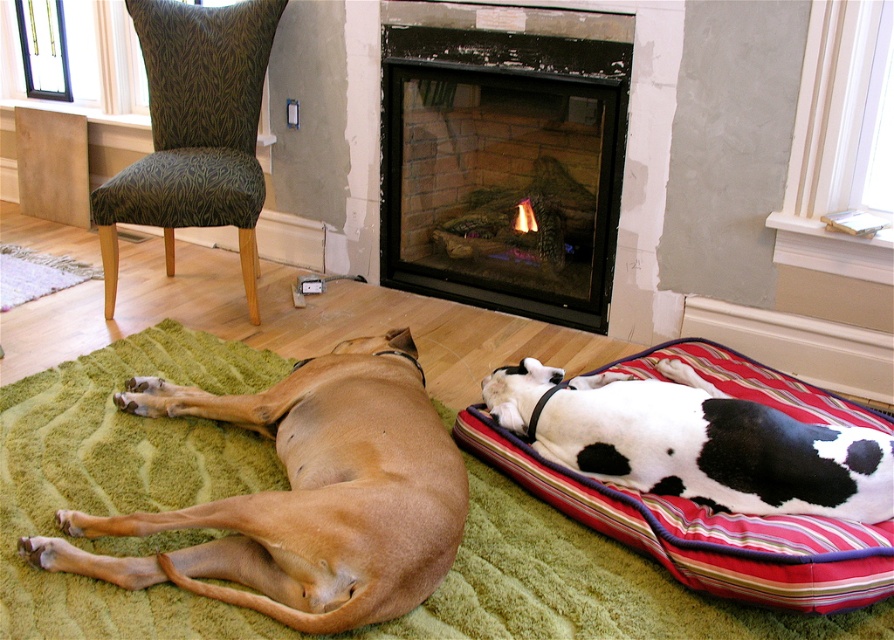
You are a contractor assessing the room. You see the brown smooth dog at lower left and the green textured fabric chair at upper left. Which object is taller?

The green textured fabric chair at upper left is taller than the brown smooth dog at lower left.